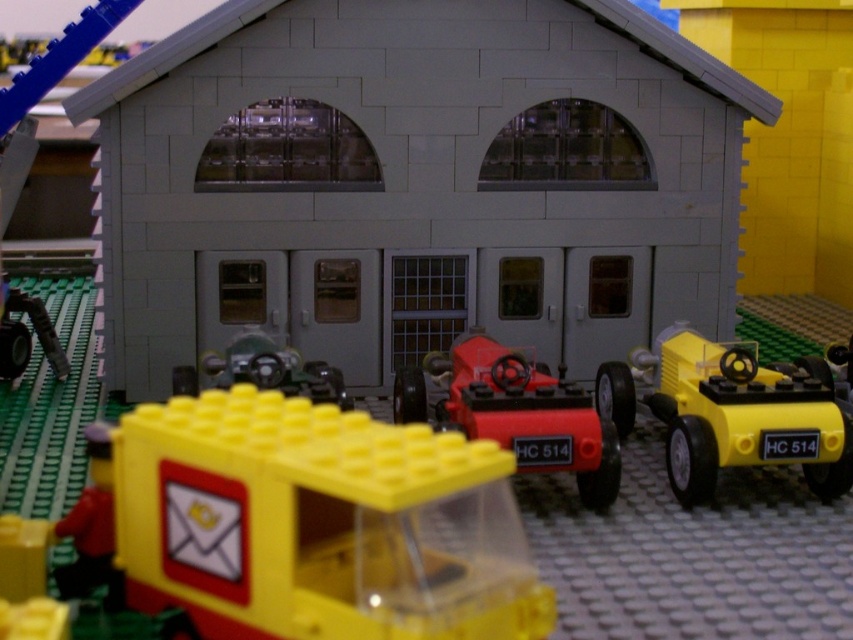
Is shiny red car at center thinner than metallic green car at center?

Incorrect, shiny red car at center's width is not less than metallic green car at center's.

Is point (610, 456) behind point (230, 346)?

No, (610, 456) is closer to viewer.

Does point (531, 422) come in front of point (270, 353)?

That is True.

Locate an element on the screen. The image size is (853, 640). shiny red car at center is located at coordinates (514, 412).

Who is positioned more to the right, translucent yellow truck at center or yellow plastic car at right?

From the viewer's perspective, yellow plastic car at right appears more on the right side.

Is point (323, 596) positioned after point (693, 492)?

No.

Does point (494, 481) come in front of point (695, 413)?

That is True.

Where is `translucent yellow truck at center`? translucent yellow truck at center is located at coordinates click(x=318, y=524).

Which of these two, translucent yellow truck at center or shiny red car at center, stands shorter?

translucent yellow truck at center is shorter.

Which is below, translucent yellow truck at center or shiny red car at center?

translucent yellow truck at center is lower down.

This screenshot has width=853, height=640. What do you see at coordinates (318, 524) in the screenshot?
I see `translucent yellow truck at center` at bounding box center [318, 524].

The image size is (853, 640). I want to click on translucent yellow truck at center, so click(x=318, y=524).